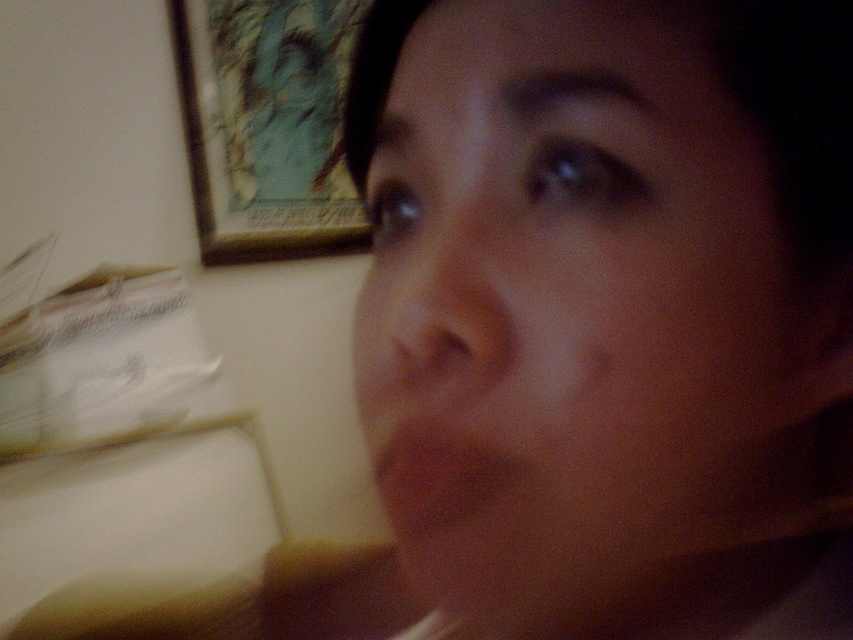
Is smooth skin face at center bigger than smooth skin at center?

Correct, smooth skin face at center is larger in size than smooth skin at center.

Can you confirm if smooth skin face at center is shorter than smooth skin at center?

No.

Describe the element at coordinates (566, 298) in the screenshot. The width and height of the screenshot is (853, 640). I see `smooth skin face at center` at that location.

Identify the location of smooth skin face at center. Image resolution: width=853 pixels, height=640 pixels. (566, 298).

Describe the element at coordinates (267, 125) in the screenshot. I see `wooden framed artwork at upper left` at that location.

The height and width of the screenshot is (640, 853). In order to click on wooden framed artwork at upper left in this screenshot , I will do `click(267, 125)`.

The width and height of the screenshot is (853, 640). In order to click on wooden framed artwork at upper left in this screenshot , I will do click(267, 125).

Is point (598, 173) positioned after point (289, 102)?

No.

Describe the element at coordinates (566, 298) in the screenshot. I see `smooth skin face at center` at that location.

Between point (506, 436) and point (334, 81), which one is positioned in front?

Point (506, 436) is more forward.

Where is `smooth skin face at center`? smooth skin face at center is located at coordinates (566, 298).